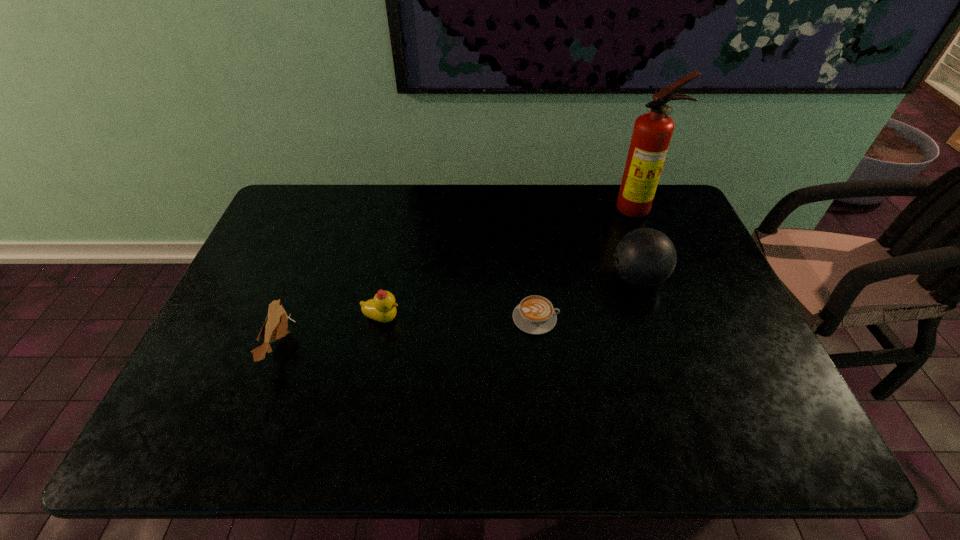
Locate an element on the screen. The width and height of the screenshot is (960, 540). the farthest object is located at coordinates (652, 132).

Locate an element on the screen. Image resolution: width=960 pixels, height=540 pixels. fire extinguisher is located at coordinates (652, 132).

I want to click on the second tallest object, so click(645, 257).

The image size is (960, 540). What are the coordinates of `bowling ball` in the screenshot? It's located at (645, 257).

At what (x,y) coordinates should I click in order to perform the action: click on duckling. Please return your answer as a coordinate pair (x, y). Image resolution: width=960 pixels, height=540 pixels. Looking at the image, I should click on (382, 308).

Identify the location of bird. The height and width of the screenshot is (540, 960). (275, 327).

Where is `the third object from left to right`? This screenshot has height=540, width=960. the third object from left to right is located at coordinates (535, 315).

Locate an element on the screen. cappuccino is located at coordinates (535, 315).

Where is `vacant space located 0.230m on the front-facing side of the fire extinguisher`? The height and width of the screenshot is (540, 960). vacant space located 0.230m on the front-facing side of the fire extinguisher is located at coordinates (662, 269).

This screenshot has height=540, width=960. Identify the location of vacant space located on the grip area of the bowling ball. [x=581, y=279].